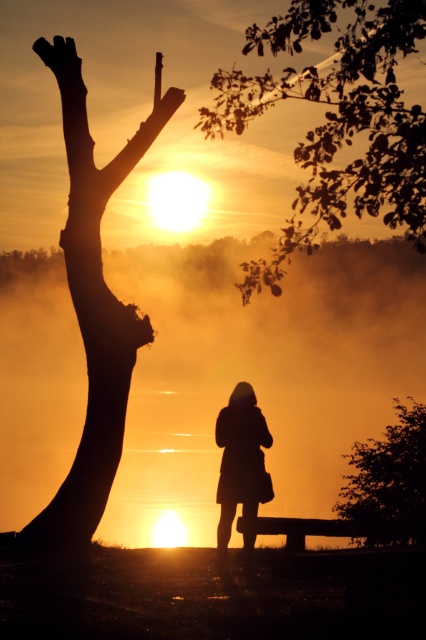
Question: Which of these objects is positioned farthest from the silhouette wood at left?

Choices:
 (A) black matte arm at center
 (B) silhouette leafy tree at upper right
 (C) wooden park bench at lower center
 (D) smooth bark tree at upper right

Answer: (C)

Question: Which is farther from the silhouette leafy tree at upper right?

Choices:
 (A) silky smooth hand at upper left
 (B) smooth bark tree at upper right
 (C) wooden park bench at lower center

Answer: (A)

Question: Can you confirm if smooth bark tree at upper right is smaller than silhouette leafy tree at upper right?

Choices:
 (A) no
 (B) yes

Answer: (B)

Question: Estimate the real-world distances between objects in this image. Which object is farther from the black matte arm at center?

Choices:
 (A) silhouette dress at center
 (B) smooth bark tree at upper right

Answer: (B)

Question: Can you confirm if silky smooth hand at upper left is thinner than black matte arm at center?

Choices:
 (A) yes
 (B) no

Answer: (B)

Question: Is silhouette leafy tree at upper right to the left of wooden park bench at lower center from the viewer's perspective?

Choices:
 (A) no
 (B) yes

Answer: (A)